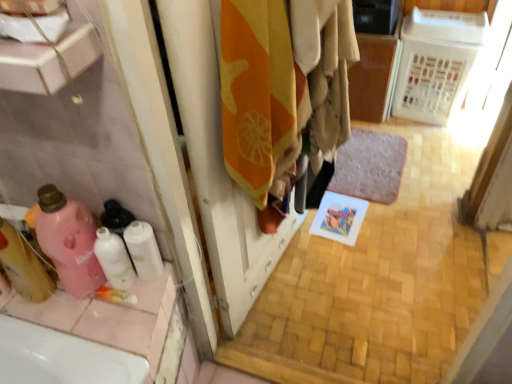
Locate an element on the screen. vacant space to the right of gray plush bath mat at center is located at coordinates (434, 158).